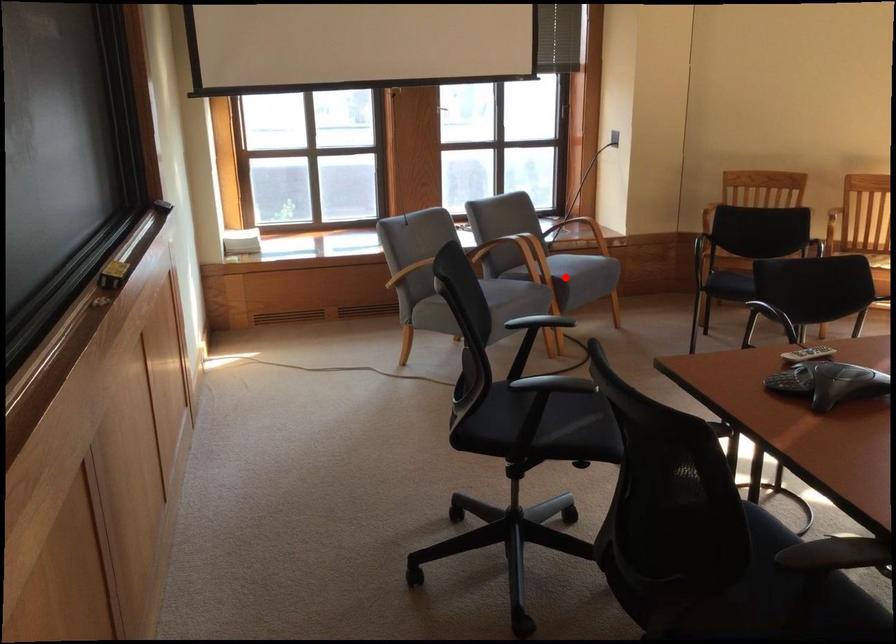
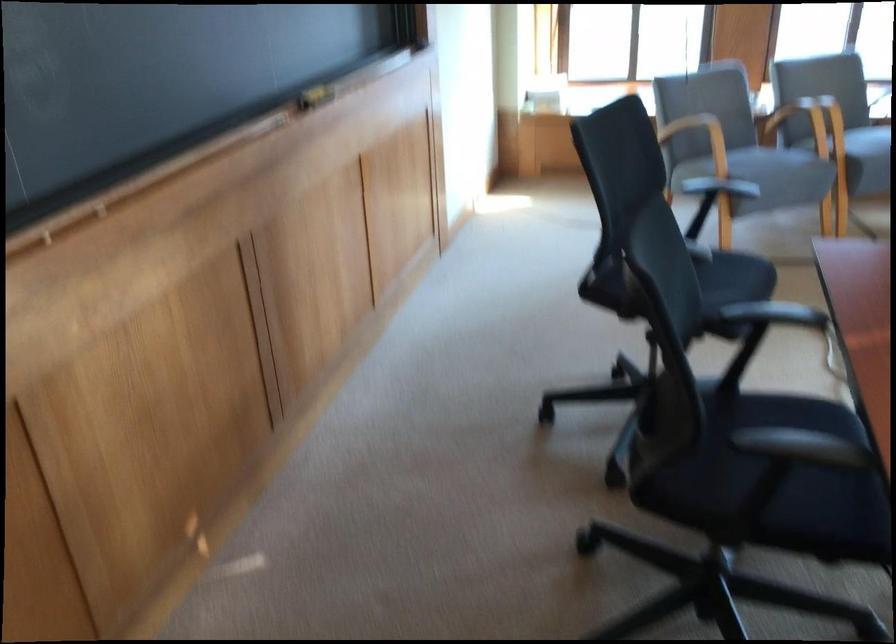
Question: I am providing you with two images of the same scene from different viewpoints. In image1, a red point is highlighted. Considering the same 3D point in image2, which of the following is correct?

Choices:
 (A) It is closer
 (B) It is farther

Answer: (A)